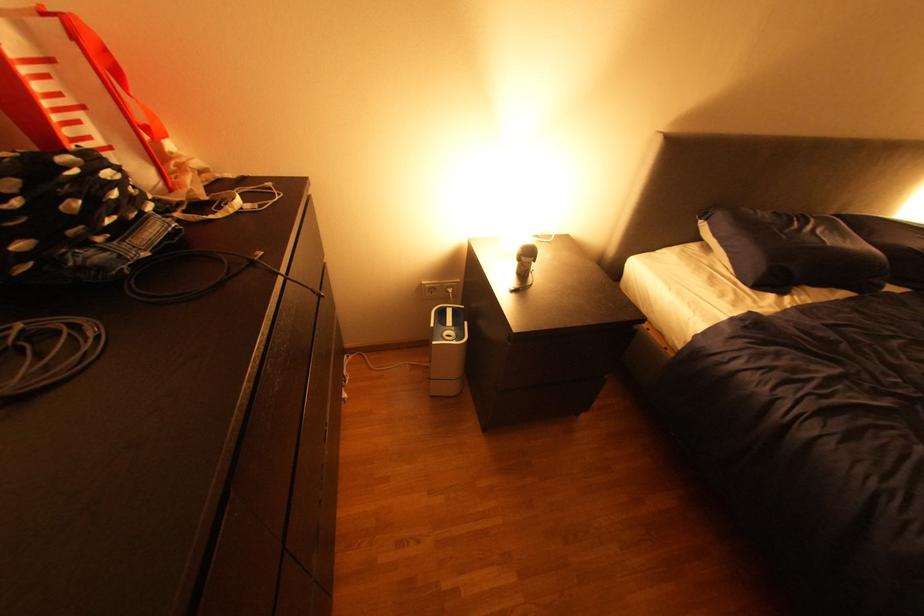
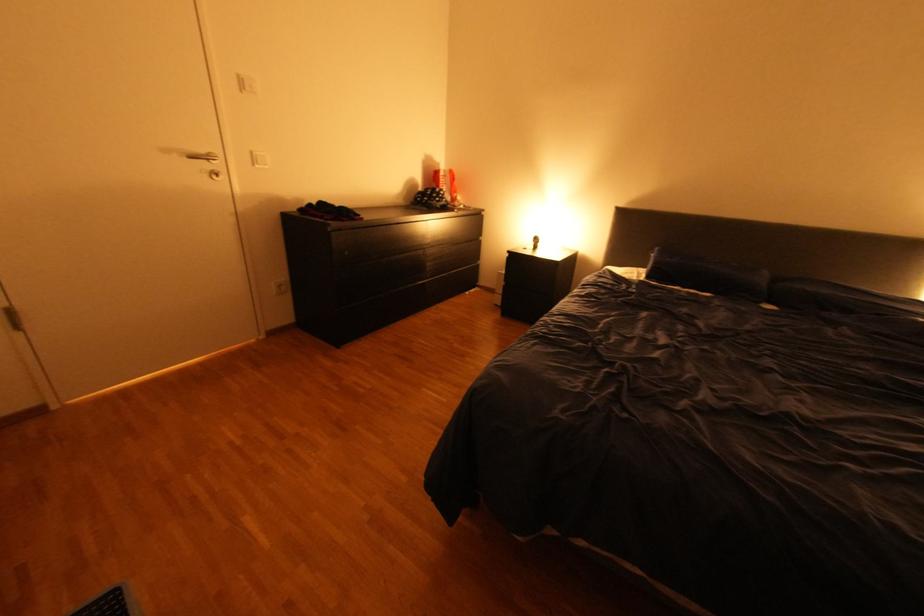
Find the pixel in the second image that matches point 141,190 in the first image.

(454, 196)